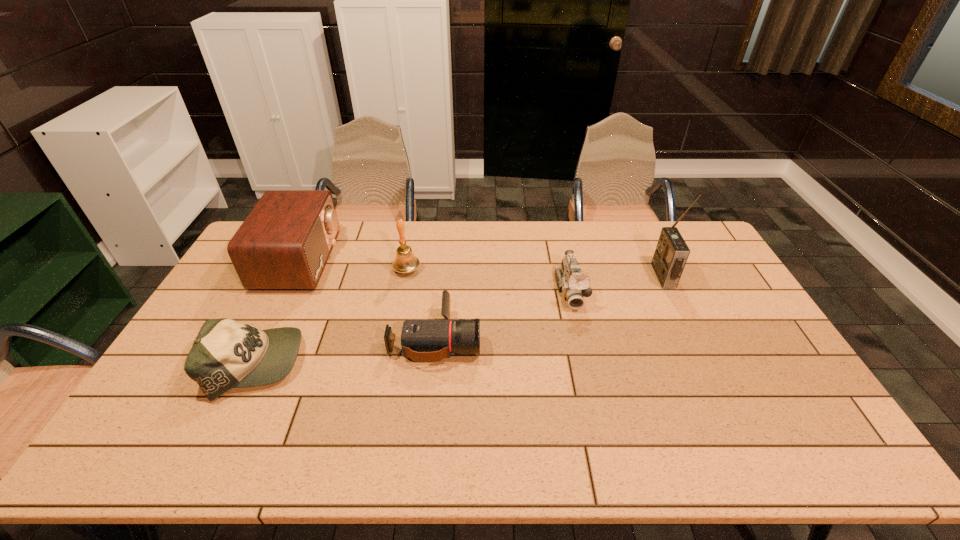
Image resolution: width=960 pixels, height=540 pixels. Find the location of `vacant space at the far edge of the desktop`. vacant space at the far edge of the desktop is located at coordinates (594, 242).

You are a GUI agent. You are given a task and a screenshot of the screen. Output one action in this format:
    pyautogui.click(x=<x>, y=<y>)
    Task: Click on the free space at the near edge of the desktop
    The width and height of the screenshot is (960, 540).
    Given the screenshot: What is the action you would take?
    pyautogui.click(x=543, y=451)

In the image, there is a desktop. Identify the location of vacant area at the left edge. This screenshot has height=540, width=960. (158, 407).

Identify the location of vacant space at the right edge of the desktop. The height and width of the screenshot is (540, 960). (784, 391).

In the image, there is a desktop. At what (x,y) coordinates should I click in order to perform the action: click on vacant area at the far right corner. Please return your answer as a coordinate pair (x, y). This screenshot has width=960, height=540. Looking at the image, I should click on (713, 250).

I want to click on free point between the shorter camcorder and the shorter radio receiver, so click(x=368, y=299).

Where is `vacant space that is in between the bell and the taller camcorder`? vacant space that is in between the bell and the taller camcorder is located at coordinates (489, 280).

At what (x,y) coordinates should I click in order to perform the action: click on vacant space that is in between the rightmost object and the right camcorder. Please return your answer as a coordinate pair (x, y). This screenshot has width=960, height=540. Looking at the image, I should click on [617, 284].

You are a GUI agent. You are given a task and a screenshot of the screen. Output one action in this format:
    pyautogui.click(x=<x>, y=<y>)
    Task: Click on the free space between the shorter radio receiver and the left camcorder
    
    Given the screenshot: What is the action you would take?
    pyautogui.click(x=368, y=299)

Find the location of a particular element. vacant area between the left radio receiver and the taller camcorder is located at coordinates (x=436, y=275).